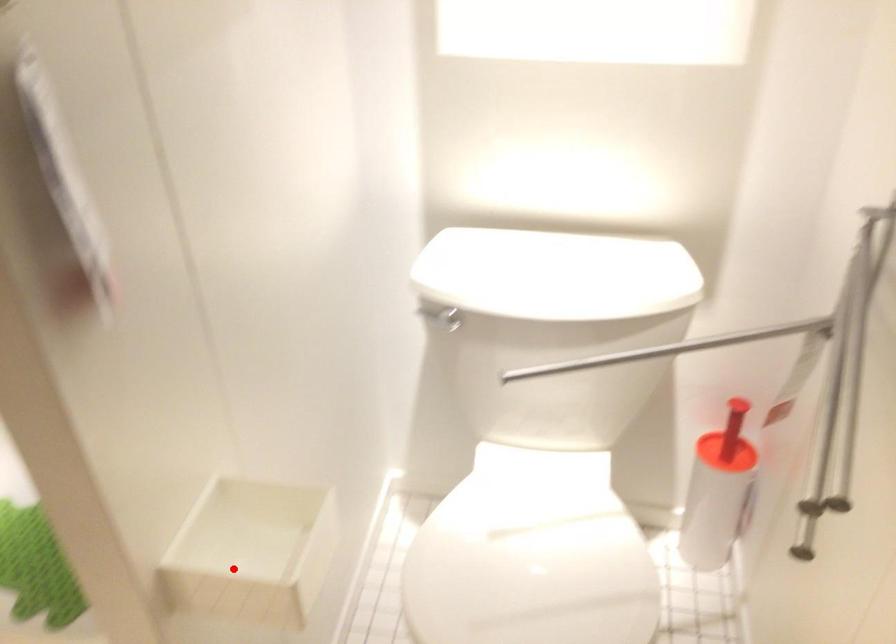
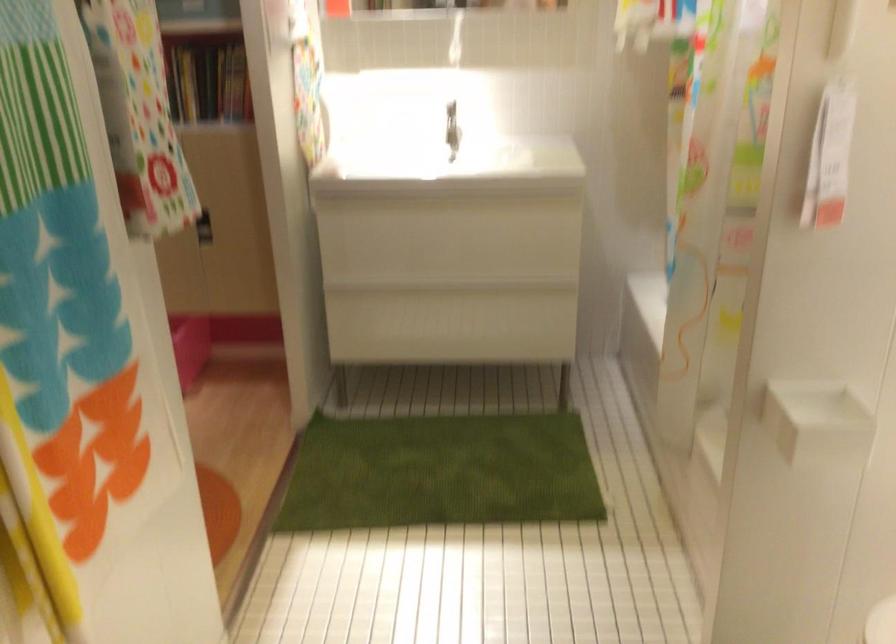
Locate, in the second image, the point that corresponds to the highlighted location in the first image.

(816, 422)